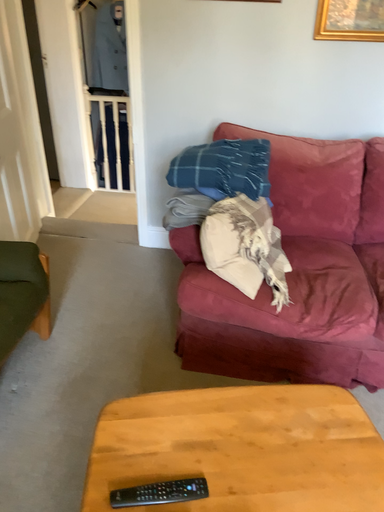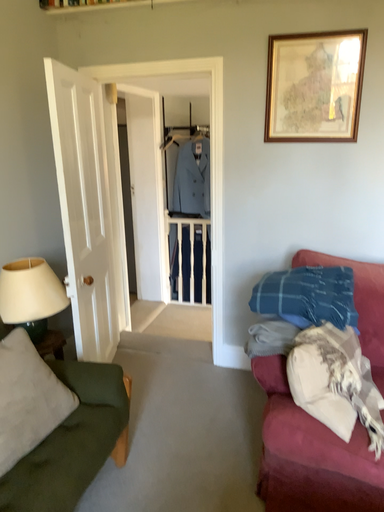
Question: Which way did the camera rotate in the video?

Choices:
 (A) rotated right
 (B) rotated left

Answer: (B)